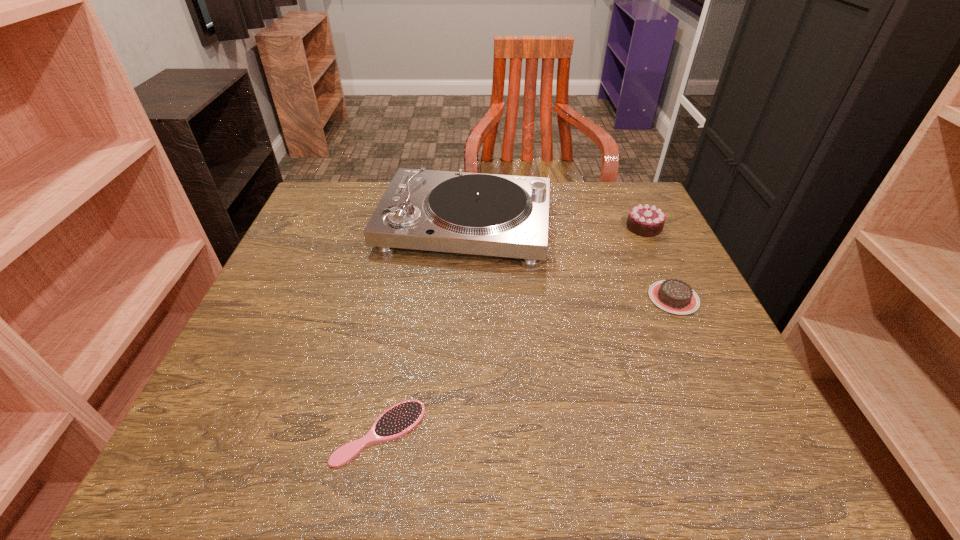
Identify the location of vacant space situated on the right of the shortest object. This screenshot has height=540, width=960. (600, 433).

Where is `record player at the far edge`? This screenshot has height=540, width=960. record player at the far edge is located at coordinates (458, 212).

The height and width of the screenshot is (540, 960). I want to click on chocolate cake that is at the far edge, so click(644, 220).

The height and width of the screenshot is (540, 960). Identify the location of object located at the near edge. (398, 420).

Find the location of a particular element. This screenshot has width=960, height=540. object located in the far right corner section of the desktop is located at coordinates (644, 220).

You are a GUI agent. You are given a task and a screenshot of the screen. Output one action in this format:
    pyautogui.click(x=<x>, y=<y>)
    Task: Click on the free point at the far edge
    Image resolution: width=960 pixels, height=540 pixels.
    Given the screenshot: What is the action you would take?
    pyautogui.click(x=552, y=190)

The image size is (960, 540). I want to click on free space at the near edge of the desktop, so click(x=427, y=429).

You are a GUI agent. You are given a task and a screenshot of the screen. Output one action in this format:
    pyautogui.click(x=<x>, y=<y>)
    Task: Click on the vacant area at the left edge
    
    Given the screenshot: What is the action you would take?
    pyautogui.click(x=339, y=256)

Find the location of a particular element. This screenshot has height=540, width=960. free space at the right edge of the desktop is located at coordinates (729, 374).

In the image, there is a desktop. Find the location of `blank space at the far right corner`. blank space at the far right corner is located at coordinates (610, 215).